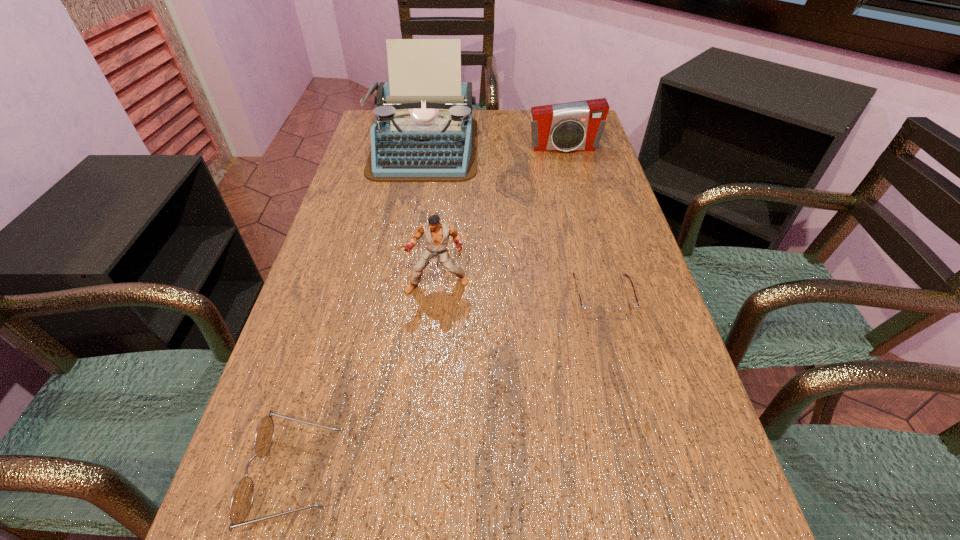
The image size is (960, 540). In order to click on free region at the far edge of the desktop in this screenshot , I will do `click(495, 122)`.

Image resolution: width=960 pixels, height=540 pixels. Find the location of `vacant region at the left edge of the desktop`. vacant region at the left edge of the desktop is located at coordinates (330, 316).

Where is `vacant space at the right edge of the desktop`? The image size is (960, 540). vacant space at the right edge of the desktop is located at coordinates click(x=589, y=158).

This screenshot has height=540, width=960. Identify the location of free point between the nearer spectacles and the puncher. (367, 380).

This screenshot has width=960, height=540. In order to click on free space that is in between the farther spectacles and the puncher in this screenshot , I will do `click(519, 292)`.

Find the location of a particular element. vacant area that lies between the typewriter and the third shortest object is located at coordinates (493, 147).

The image size is (960, 540). Identify the location of free space between the nearer spectacles and the right spectacles. (449, 387).

Locate an element on the screen. The width and height of the screenshot is (960, 540). vacant space that's between the second tallest object and the typewriter is located at coordinates (430, 215).

I want to click on empty space that is in between the puncher and the typewriter, so click(430, 215).

Locate an element on the screen. free spot between the fourth tallest object and the right spectacles is located at coordinates (449, 387).